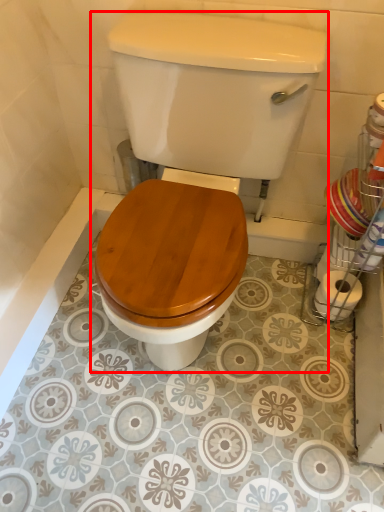
Question: From the image's perspective, what is the correct spatial positioning of toilet (annotated by the red box) in reference to toilet paper?

Choices:
 (A) above
 (B) below

Answer: (A)